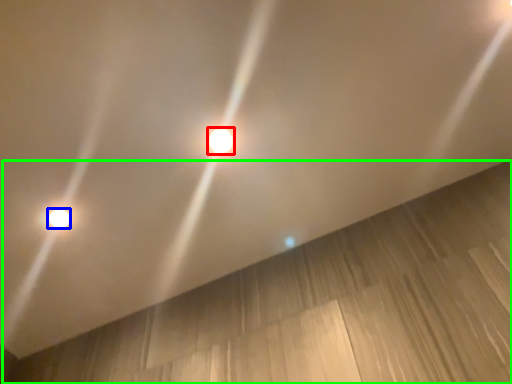
Question: Estimate the real-world distances between objects in this image. Which object is farther from lamp (highlighted by a red box), lamp (highlighted by a blue box) or plywood (highlighted by a green box)?

Choices:
 (A) lamp
 (B) plywood

Answer: (B)